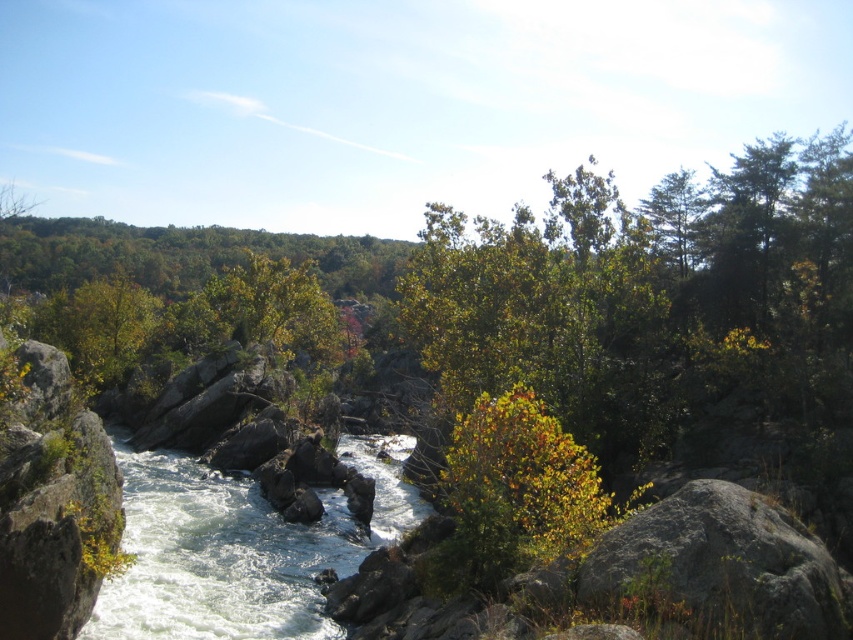
Question: Is white frothy water at center to the right of green leafy bush at center from the viewer's perspective?

Choices:
 (A) yes
 (B) no

Answer: (B)

Question: Is white frothy water at center to the right of green leafy bush at center from the viewer's perspective?

Choices:
 (A) no
 (B) yes

Answer: (A)

Question: Which of the following is the closest to the observer?

Choices:
 (A) white frothy water at center
 (B) green leafy bush at center

Answer: (B)

Question: Which point appears farthest from the camera in this image?

Choices:
 (A) (321, 612)
 (B) (529, 408)

Answer: (A)

Question: Considering the relative positions of white frothy water at center and green leafy bush at center in the image provided, where is white frothy water at center located with respect to green leafy bush at center?

Choices:
 (A) below
 (B) above

Answer: (A)